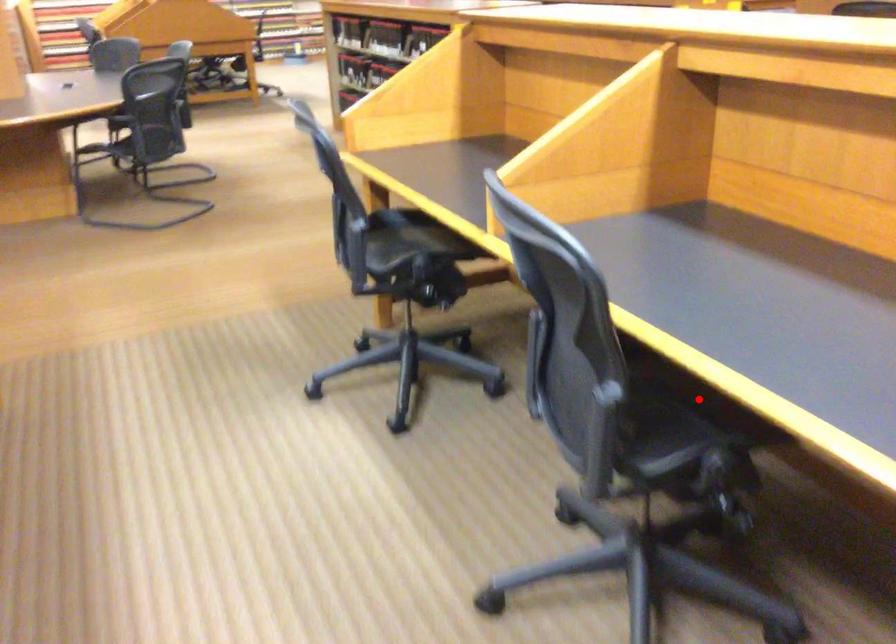
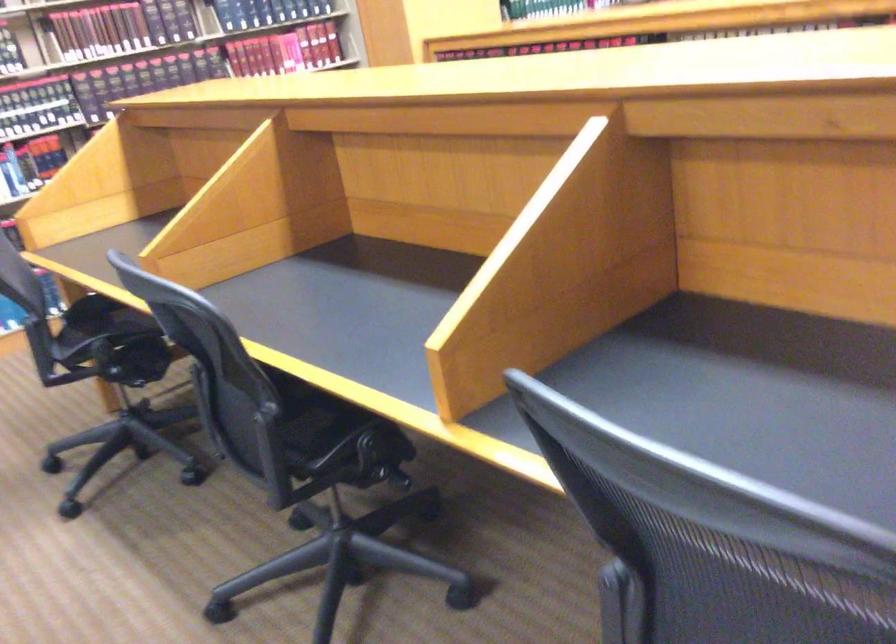
Question: I am providing you with two images of the same scene from different viewpoints. A red point is marked on the first image. Can you still see the location of the red point in image 2?

Choices:
 (A) Yes
 (B) No

Answer: (B)